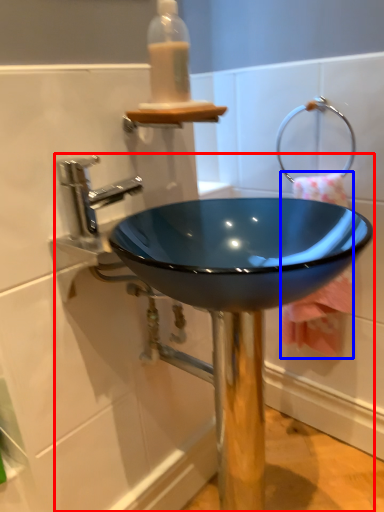
Question: Which point is closer to the camera, sink (highlighted by a red box) or bath towel (highlighted by a blue box)?

Choices:
 (A) sink
 (B) bath towel

Answer: (A)